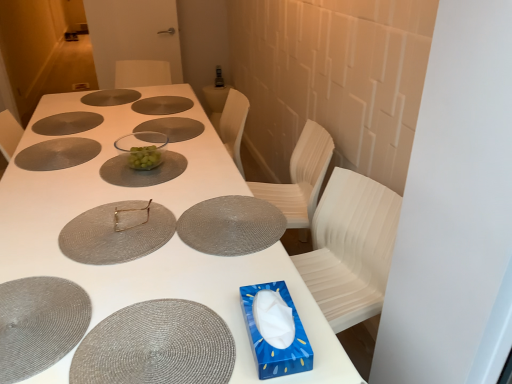
Identify the location of vacant space in between matte gray placemat at center, arranged as the second glass plate when viewed from the front, and blue paper tissue box at lower right. This screenshot has height=384, width=512. pyautogui.click(x=180, y=261).